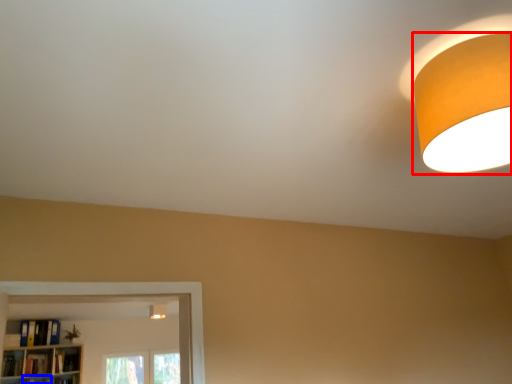
Question: Which point is further to the camera, lamp (highlighted by a red box) or shelf (highlighted by a blue box)?

Choices:
 (A) lamp
 (B) shelf

Answer: (B)